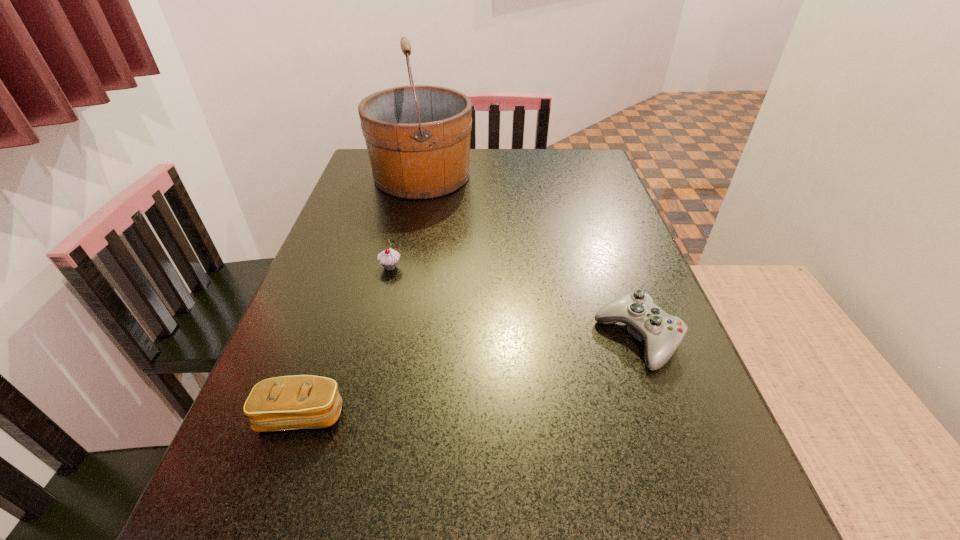
This screenshot has width=960, height=540. I want to click on object that is at the far edge, so click(418, 137).

Locate an element on the screen. The width and height of the screenshot is (960, 540). bucket situated at the left edge is located at coordinates (418, 137).

You are a GUI agent. You are given a task and a screenshot of the screen. Output one action in this format:
    pyautogui.click(x=<x>, y=<y>)
    Task: Click on the cupcake that is positioned at the left edge
    
    Given the screenshot: What is the action you would take?
    pyautogui.click(x=388, y=258)

This screenshot has height=540, width=960. Identify the location of clutch bag that is at the left edge. tap(302, 401).

Where is `object present at the right edge`? The width and height of the screenshot is (960, 540). object present at the right edge is located at coordinates (662, 333).

Identify the location of object that is positioned at the far left corner. The width and height of the screenshot is (960, 540). (418, 137).

This screenshot has width=960, height=540. In the image, there is a desktop. What are the coordinates of `vacant space at the far edge` in the screenshot? It's located at tap(484, 173).

In the image, there is a desktop. At what (x,y) coordinates should I click in order to perform the action: click on vacant space at the left edge. Please return your answer as a coordinate pair (x, y). Looking at the image, I should click on (368, 212).

In the image, there is a desktop. In order to click on vacant space at the right edge in this screenshot , I will do `click(595, 235)`.

In the image, there is a desktop. Identify the location of vacant space at the far right corner. The image size is (960, 540). (591, 172).